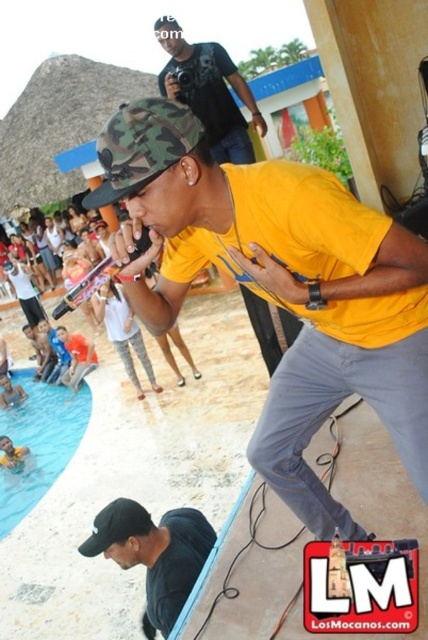
Question: Which point is farther to the camera?

Choices:
 (A) matte black t-shirt at upper center
 (B) camo fabric hat at upper left
 (C) yellow rubber ring at lower left
 (D) black matte cap at lower left

Answer: (C)

Question: Does blue smooth water at lower left have a larger size compared to matte black t-shirt at upper center?

Choices:
 (A) no
 (B) yes

Answer: (B)

Question: Can you confirm if black matte cap at lower left is thinner than blue smooth water at lower left?

Choices:
 (A) no
 (B) yes

Answer: (B)

Question: Which of these objects is positioned farthest from the blue smooth water at lower left?

Choices:
 (A) black matte cap at lower left
 (B) yellow rubber ring at lower left
 (C) matte black t-shirt at upper center
 (D) camo fabric hat at upper left

Answer: (C)

Question: Based on their relative distances, which object is nearer to the blue smooth water at lower left?

Choices:
 (A) yellow rubber ring at lower left
 (B) black matte cap at lower left
 (C) matte black t-shirt at upper center

Answer: (A)

Question: Does blue smooth water at lower left have a lesser width compared to yellow rubber ring at lower left?

Choices:
 (A) yes
 (B) no

Answer: (B)